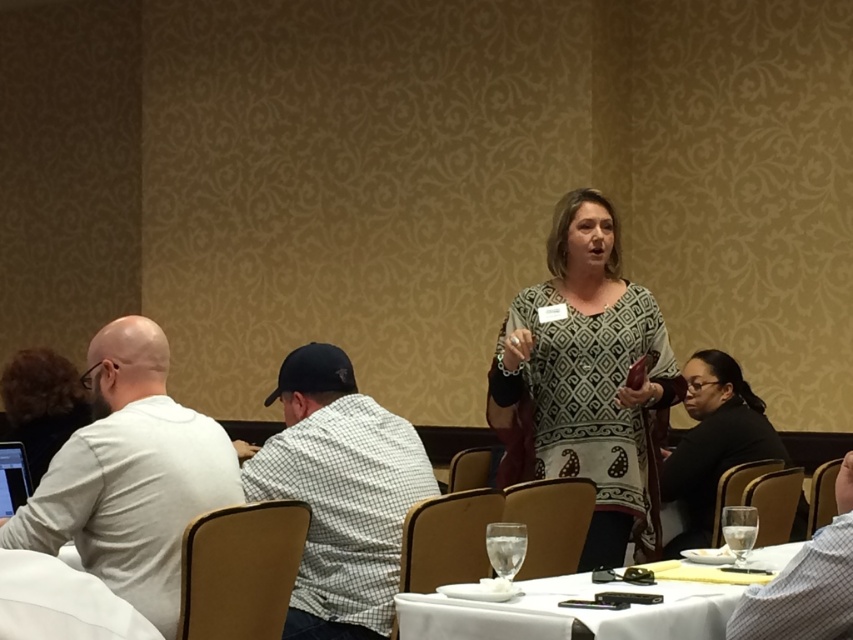
Question: Is white matte shirt at left positioned in front of white checkered shirt at center?

Choices:
 (A) yes
 (B) no

Answer: (A)

Question: Which point is farther from the camera taking this photo?

Choices:
 (A) (496, 538)
 (B) (485, 604)
 (C) (569, 253)

Answer: (C)

Question: Can you confirm if white matte shirt at left is positioned below clear glass at table center?

Choices:
 (A) yes
 (B) no

Answer: (B)

Question: Can you confirm if white checkered shirt at lower right is positioned to the right of clear glass at table right?

Choices:
 (A) no
 (B) yes

Answer: (B)

Question: Which point is closer to the camera taking this photo?

Choices:
 (A) (735, 452)
 (B) (761, 632)
 (C) (102, 529)

Answer: (B)

Question: Considering the real-world distances, which object is closest to the white checkered shirt at lower right?

Choices:
 (A) patterned fabric shirt at center
 (B) clear glass at table right

Answer: (B)